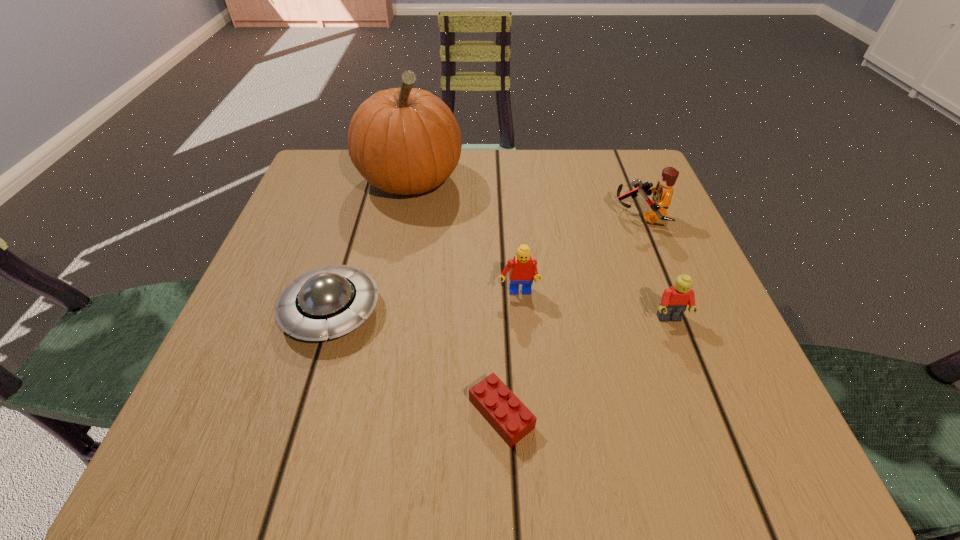
In order to click on object situated at the far left corner in this screenshot , I will do `click(406, 140)`.

At what (x,y) coordinates should I click in order to perform the action: click on object positioned at the far right corner. Please return your answer as a coordinate pair (x, y). The height and width of the screenshot is (540, 960). Looking at the image, I should click on (662, 193).

I want to click on vacant region at the far edge of the desktop, so coord(570,156).

This screenshot has width=960, height=540. Identify the location of vacant point at the left edge. (277, 276).

Where is `vacant region at the right edge`? vacant region at the right edge is located at coordinates (676, 246).

This screenshot has width=960, height=540. In order to click on vacant space at the far left corner of the desktop in this screenshot , I will do `click(322, 184)`.

In the image, there is a desktop. Where is `vacant space at the near left corner`? This screenshot has width=960, height=540. vacant space at the near left corner is located at coordinates (248, 464).

Image resolution: width=960 pixels, height=540 pixels. In the image, there is a desktop. What are the coordinates of `vacant space at the far right corner` in the screenshot? It's located at (591, 164).

Find the location of `vacant region at the near right corner of the desktop`. vacant region at the near right corner of the desktop is located at coordinates (766, 421).

Where is `empty location between the second farthest Lego and the shortest object`? Image resolution: width=960 pixels, height=540 pixels. empty location between the second farthest Lego and the shortest object is located at coordinates (510, 354).